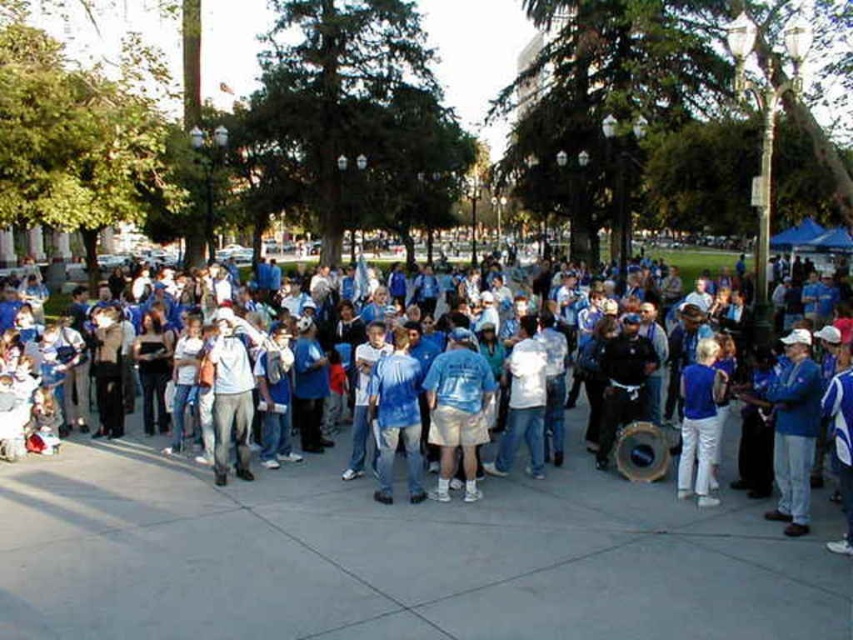
You are standing at the point labeled as point (418, 390) in the image. You want to walk towards the point labeled as point (469, 497). Which direction should you move to reach there?

To reach point (469, 497) from point (418, 390), you should move forward since point (469, 497) is in front of point (418, 390).

You are standing at the origin point of the coordinate system where the bottom left corner is considered as the origin. The blue tie dye shirt at center is located at point (397, 417). If you want to walk towards the blue tie dye shirt at center, which direction should you move? Please provide your answer in terms of coordinate directions.

To reach the blue tie dye shirt at center located at point (397, 417) from the origin, you should move in the positive x and positive y directions since both coordinates are greater than zero.